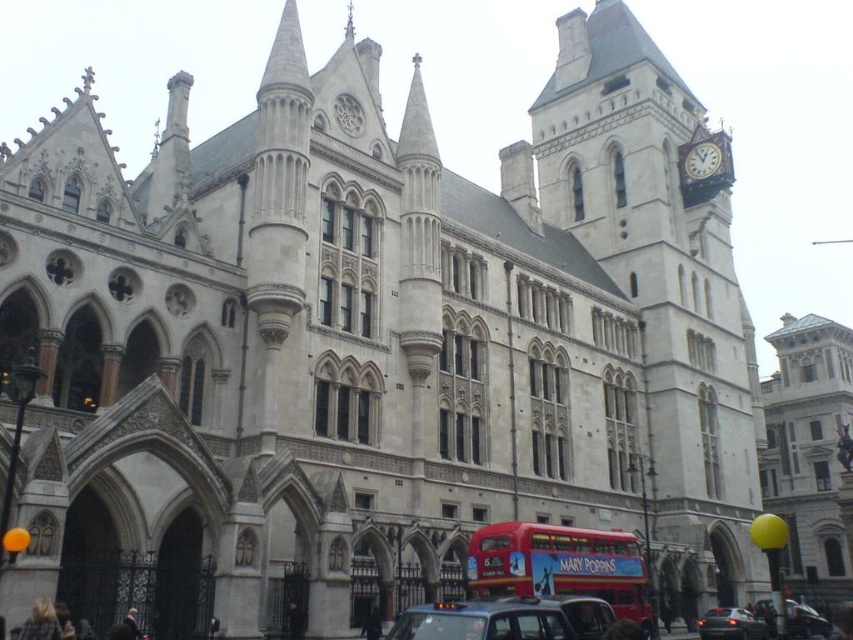
Question: Which is nearer to the red matte double-decker bus at center?

Choices:
 (A) white wooden clock at upper right
 (B) black rubber taxi at center
 (C) shiny black sedan at lower right
 (D) metallic silver car at lower right

Answer: (B)

Question: Can you confirm if red matte double-decker bus at center is positioned below white wooden clock at upper right?

Choices:
 (A) yes
 (B) no

Answer: (A)

Question: Which point is closer to the camera?

Choices:
 (A) red matte double-decker bus at center
 (B) shiny black sedan at lower right

Answer: (A)

Question: Is black rubber taxi at center above white wooden clock at upper right?

Choices:
 (A) yes
 (B) no

Answer: (B)

Question: Considering the real-world distances, which object is farthest from the white wooden clock at upper right?

Choices:
 (A) shiny black sedan at lower right
 (B) black rubber taxi at center
 (C) metallic silver car at lower right

Answer: (B)

Question: Does shiny black sedan at lower right have a lesser width compared to white wooden clock at upper right?

Choices:
 (A) no
 (B) yes

Answer: (A)